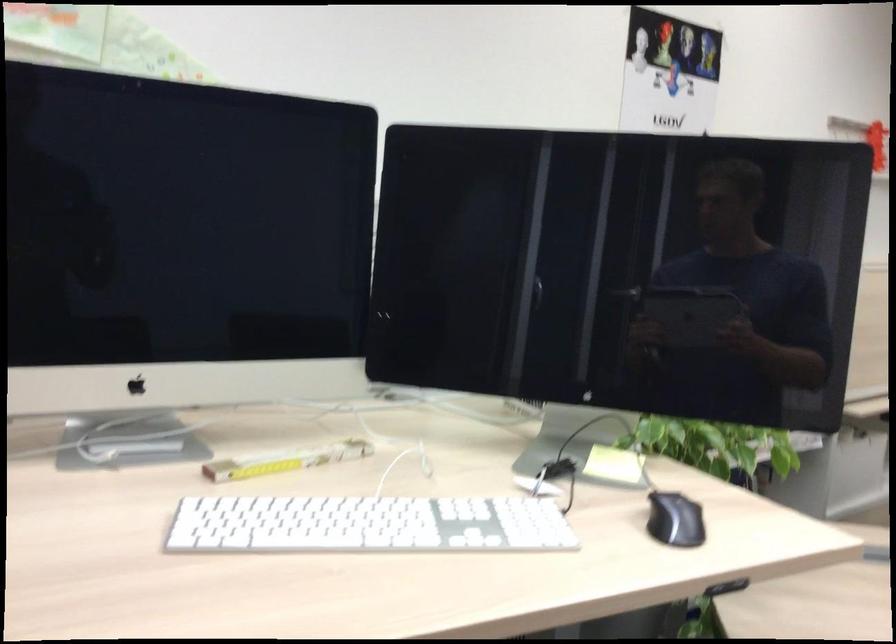
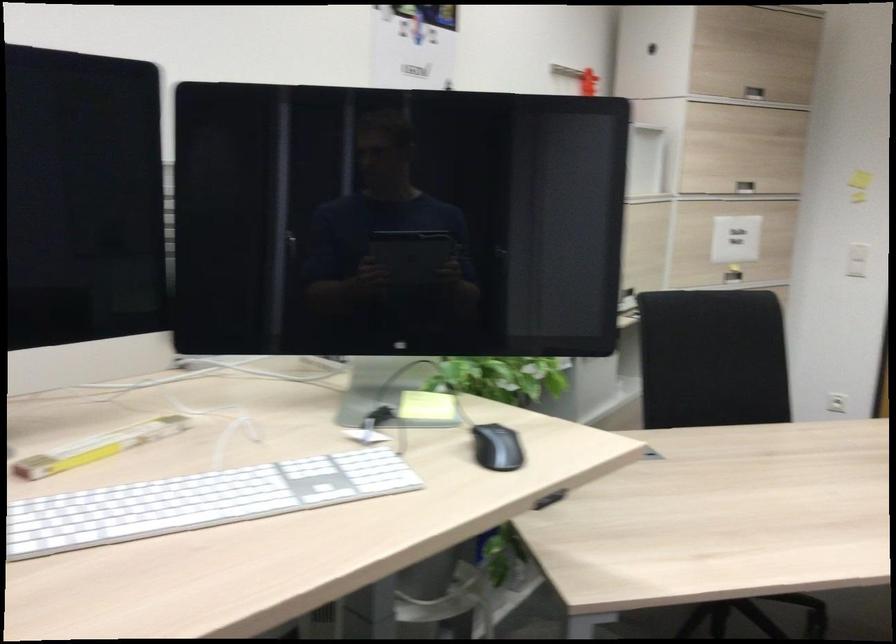
In the second image, find the point that corresponds to (349,524) in the first image.

(200, 500)